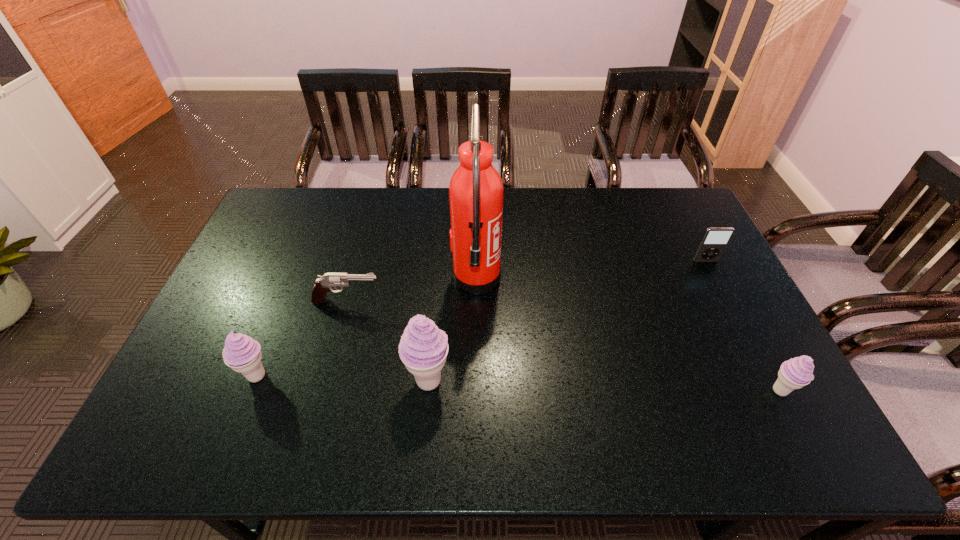
Identify the location of the leftmost object. Image resolution: width=960 pixels, height=540 pixels. (241, 353).

Find the location of a particular element. The width and height of the screenshot is (960, 540). the leftmost icecream is located at coordinates (241, 353).

The height and width of the screenshot is (540, 960). Identify the location of the second tallest object. (423, 348).

In order to click on the second icecream from right to left in this screenshot , I will do `click(423, 348)`.

Find the location of `the shortest icecream`. the shortest icecream is located at coordinates (795, 373).

Image resolution: width=960 pixels, height=540 pixels. In order to click on iPod in this screenshot , I will do (x=715, y=240).

I want to click on gun, so click(323, 284).

Identify the location of the tallest object. (476, 191).

Image resolution: width=960 pixels, height=540 pixels. In order to click on free spot located 0.100m on the right of the leftmost icecream in this screenshot , I will do `click(313, 376)`.

Identify the location of free space located 0.180m on the back of the second icecream from left to right. (435, 309).